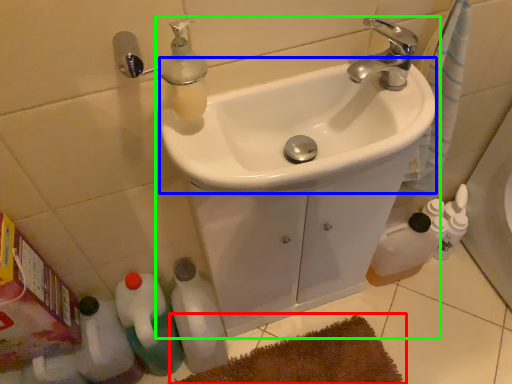
Question: Which object is the farthest from bath mat (highlighted by a red box)? Choose among these: sink (highlighted by a blue box) or sink (highlighted by a green box).

Choices:
 (A) sink
 (B) sink

Answer: (A)